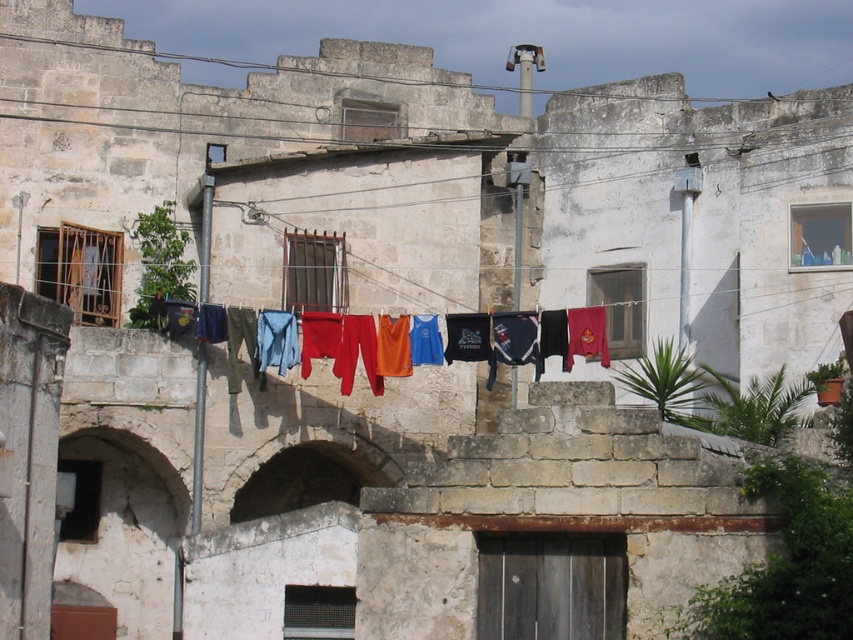
You are a painter standing in front of the old stone building. You want to paint the stone archway at center and the multicolored fabric at center. Which object should you focus on first if you want to paint the larger one first?

The stone archway at center is bigger than the multicolored fabric at center, so you should focus on painting the stone archway at center first.

You are standing in front of the old stone building. There is a stone archway at center and a multicolored fabric at center. Which object is closer to the ground?

The stone archway at center is below the multicolored fabric at center, so the stone archway at center is closer to the ground.